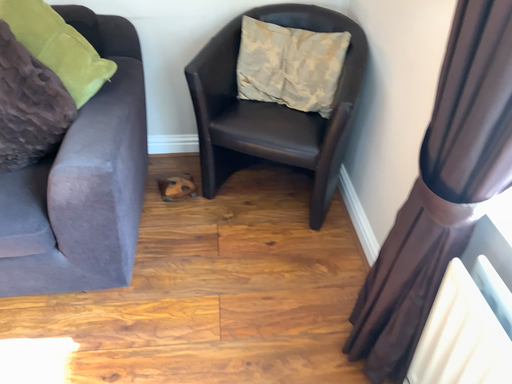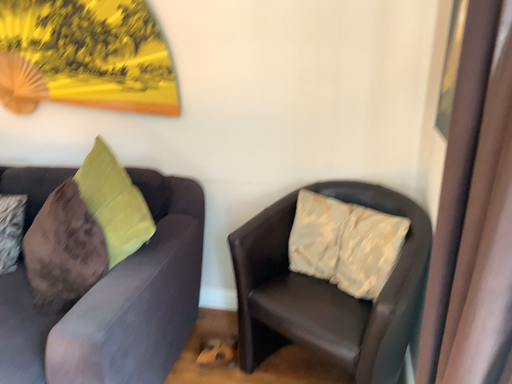
Question: How did the camera likely rotate when shooting the video?

Choices:
 (A) rotated left
 (B) rotated right

Answer: (A)